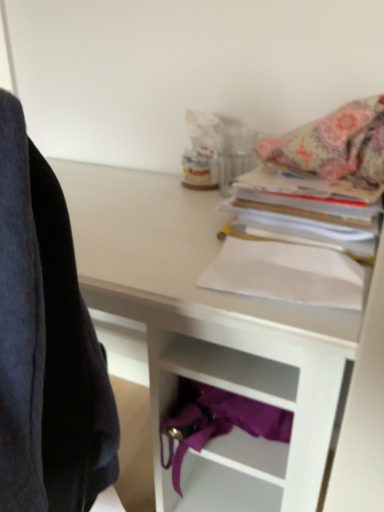
Question: Is white matte desk at upper center at the right side of white paper at center, positioned as the 2th paperback book in top-to-bottom order?

Choices:
 (A) no
 (B) yes

Answer: (A)

Question: From a real-world perspective, is white matte desk at upper center on white paper at center, placed as the 1th paperback book when sorted from bottom to top?

Choices:
 (A) yes
 (B) no

Answer: (B)

Question: Can you confirm if white matte desk at upper center is taller than white paper at center, placed as the 1th paperback book when sorted from bottom to top?

Choices:
 (A) no
 (B) yes

Answer: (B)

Question: From the image's perspective, would you say white matte desk at upper center is positioned over white paper at center, placed as the 1th paperback book when sorted from bottom to top?

Choices:
 (A) yes
 (B) no

Answer: (B)

Question: From a real-world perspective, is white matte desk at upper center physically below white paper at center, placed as the 1th paperback book when sorted from bottom to top?

Choices:
 (A) no
 (B) yes

Answer: (B)

Question: Does white matte desk at upper center have a greater width compared to white paper at center, placed as the 1th paperback book when sorted from bottom to top?

Choices:
 (A) no
 (B) yes

Answer: (B)

Question: Does patterned fabric blanket at upper right appear on the right side of white paper at center, positioned as the 2th paperback book in top-to-bottom order?

Choices:
 (A) no
 (B) yes

Answer: (B)

Question: Are patterned fabric blanket at upper right and white paper at center, positioned as the 2th paperback book in top-to-bottom order, located far from each other?

Choices:
 (A) no
 (B) yes

Answer: (A)

Question: Considering the relative sizes of patterned fabric blanket at upper right and white paper at center, positioned as the 2th paperback book in top-to-bottom order, in the image provided, is patterned fabric blanket at upper right taller than white paper at center, positioned as the 2th paperback book in top-to-bottom order,?

Choices:
 (A) yes
 (B) no

Answer: (A)

Question: From the image's perspective, is patterned fabric blanket at upper right beneath white paper at center, placed as the 1th paperback book when sorted from bottom to top?

Choices:
 (A) no
 (B) yes

Answer: (A)

Question: Can you confirm if patterned fabric blanket at upper right is positioned to the left of white paper at center, placed as the 1th paperback book when sorted from bottom to top?

Choices:
 (A) yes
 (B) no

Answer: (B)

Question: Is patterned fabric blanket at upper right with white paper at center, placed as the 1th paperback book when sorted from bottom to top?

Choices:
 (A) yes
 (B) no

Answer: (B)

Question: Is white paper at upper right, which is counted as the first paperback book, starting from the top, taller than white paper at center, positioned as the 2th paperback book in top-to-bottom order?

Choices:
 (A) yes
 (B) no

Answer: (A)